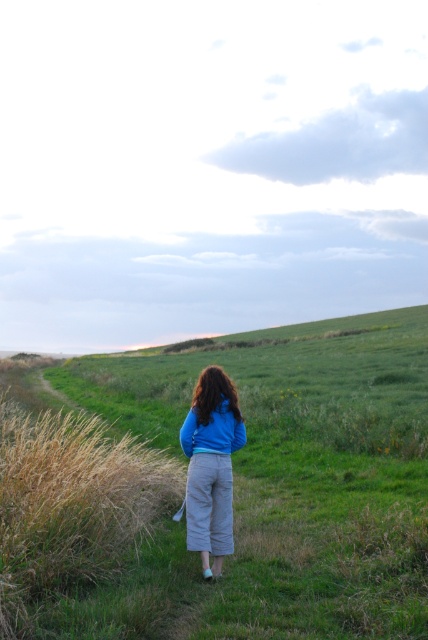
Question: Observing the image, what is the correct spatial positioning of blue cotton jacket at center in reference to blue fleece sweatshirt at center?

Choices:
 (A) right
 (B) left

Answer: (B)

Question: Which of the following is the farthest from the observer?

Choices:
 (A) blue fleece sweatshirt at center
 (B) blue cotton jacket at center

Answer: (A)

Question: Can you confirm if blue cotton jacket at center is positioned to the left of blue fleece sweatshirt at center?

Choices:
 (A) no
 (B) yes

Answer: (B)

Question: Can you confirm if blue cotton jacket at center is positioned to the left of blue fleece sweatshirt at center?

Choices:
 (A) yes
 (B) no

Answer: (A)